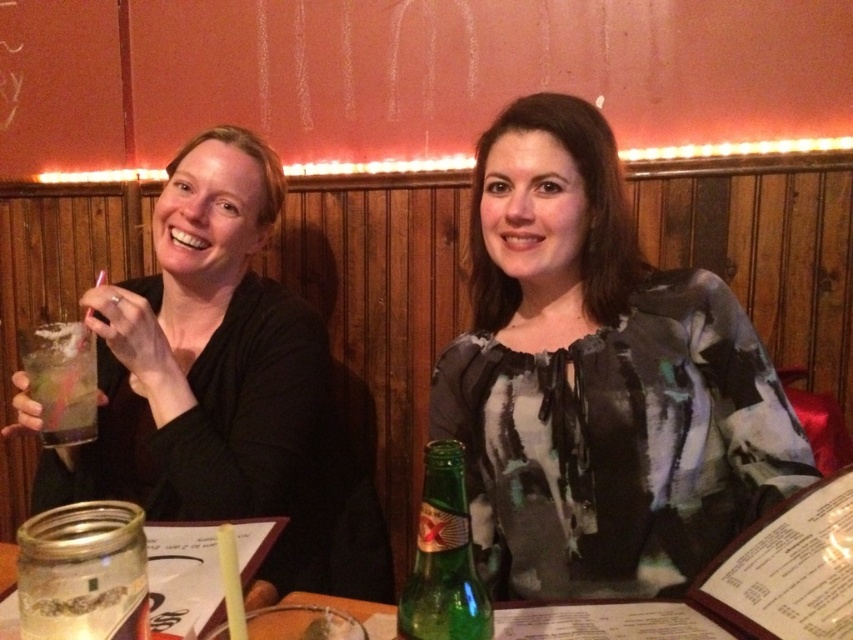
Is printed silk blouse at center taller than green glass bottle at center?

Yes, printed silk blouse at center is taller than green glass bottle at center.

Who is positioned more to the right, printed silk blouse at center or green glass bottle at center?

Positioned to the right is printed silk blouse at center.

At what (x,y) coordinates should I click in order to perform the action: click on printed silk blouse at center. Please return your answer as a coordinate pair (x, y). Looking at the image, I should click on (599, 380).

Who is higher up, matte black shirt at left or green glass bottle at center?

Positioned higher is matte black shirt at left.

Is point (306, 445) positioned in front of point (473, 634)?

No, it is behind (473, 634).

Describe the element at coordinates (210, 371) in the screenshot. Image resolution: width=853 pixels, height=640 pixels. I see `matte black shirt at left` at that location.

Find the location of a particular element. This screenshot has height=640, width=853. matte black shirt at left is located at coordinates (210, 371).

Between matte black shirt at left and clear plastic cup at left, which one is positioned higher?

Positioned higher is matte black shirt at left.

Between matte black shirt at left and clear plastic cup at left, which one has less height?

clear plastic cup at left is shorter.

Who is more distant from viewer, (144, 298) or (94, 392)?

Positioned behind is point (144, 298).

Locate an element on the screen. Image resolution: width=853 pixels, height=640 pixels. matte black shirt at left is located at coordinates (210, 371).